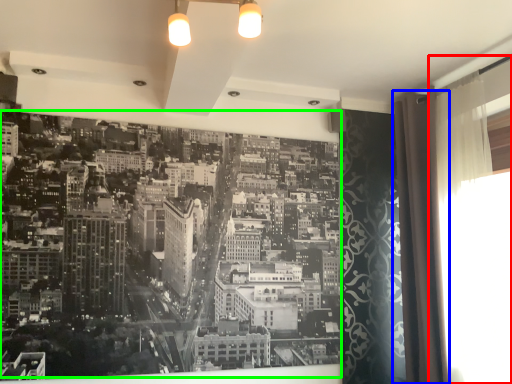
Question: Estimate the real-world distances between objects in this image. Which object is closer to window screen (highlighted by a red box), shower curtain (highlighted by a blue box) or hotel (highlighted by a green box)?

Choices:
 (A) shower curtain
 (B) hotel

Answer: (A)